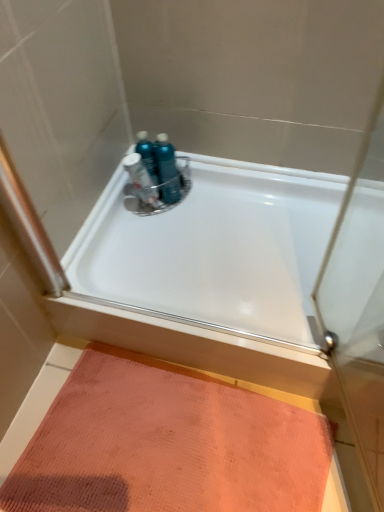
Where is `free point to the right of teal plastic bottles at center, the third toiletry viewed from the left`? Image resolution: width=384 pixels, height=512 pixels. free point to the right of teal plastic bottles at center, the third toiletry viewed from the left is located at coordinates (219, 193).